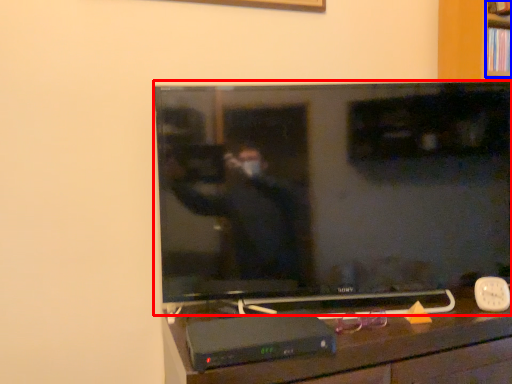
Question: Among these objects, which one is nearest to the camera, television (highlighted by a red box) or shelf (highlighted by a blue box)?

Choices:
 (A) television
 (B) shelf

Answer: (A)